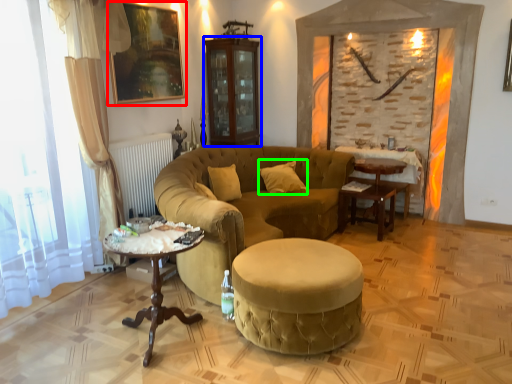
Question: Which object is positioned farthest from picture frame (highlighted by a red box)? Select from armoire (highlighted by a blue box) and pillow (highlighted by a green box).

Choices:
 (A) armoire
 (B) pillow

Answer: (B)